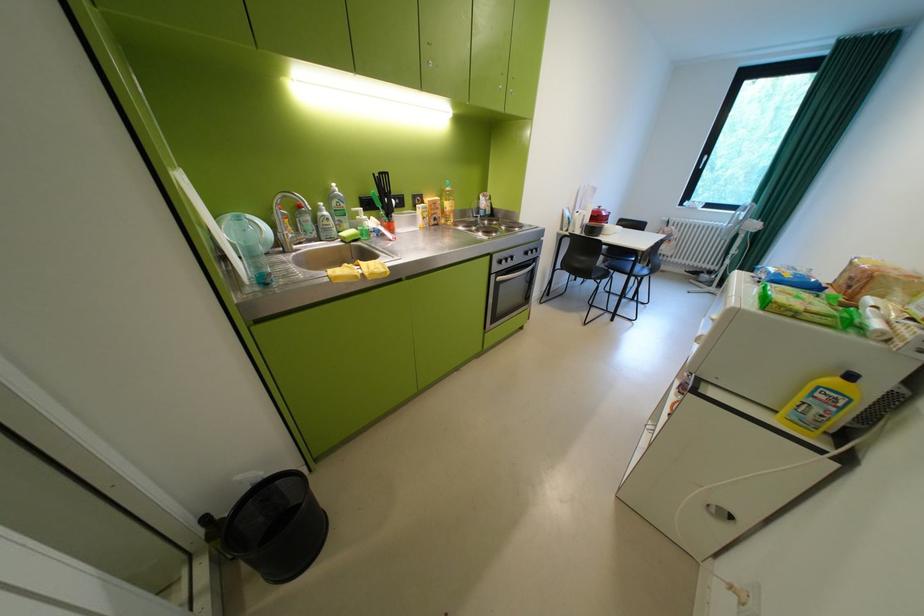
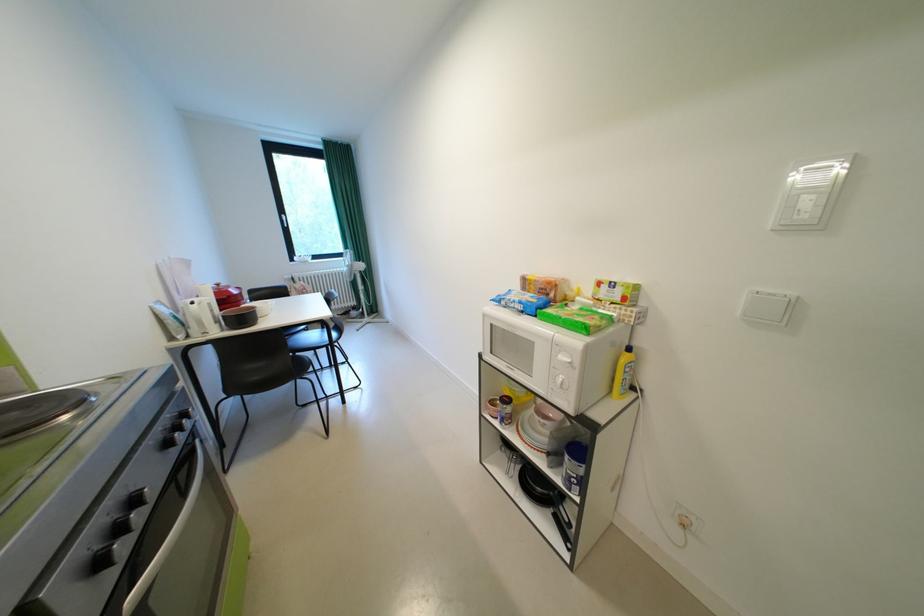
Locate, in the second image, the point that corresponds to (523,257) in the first image.

(146, 501)